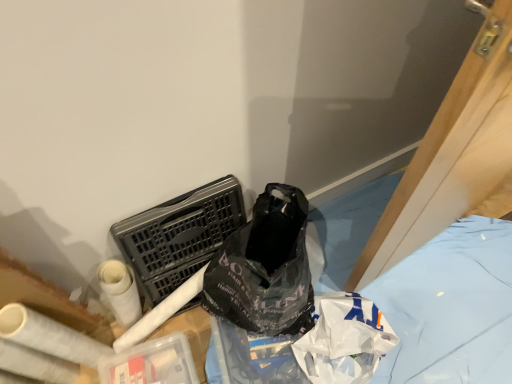
Question: Is white matte toilet paper at lower left shorter than black plastic bag at lower right?

Choices:
 (A) yes
 (B) no

Answer: (B)

Question: Does white matte toilet paper at lower left have a smaller size compared to black plastic bag at lower right?

Choices:
 (A) no
 (B) yes

Answer: (B)

Question: Considering the relative positions of white matte toilet paper at lower left and black plastic bag at lower right in the image provided, is white matte toilet paper at lower left to the right of black plastic bag at lower right from the viewer's perspective?

Choices:
 (A) no
 (B) yes

Answer: (A)

Question: From the image's perspective, would you say white matte toilet paper at lower left is shown under black plastic bag at lower right?

Choices:
 (A) no
 (B) yes

Answer: (A)

Question: Is white matte toilet paper at lower left positioned before black plastic bag at lower right?

Choices:
 (A) no
 (B) yes

Answer: (B)

Question: From a real-world perspective, is white matte toilet paper at lower left on top of black plastic bag at lower right?

Choices:
 (A) no
 (B) yes

Answer: (B)

Question: Is black plastic bag at lower right not close to black plastic laundry basket at center-left?

Choices:
 (A) yes
 (B) no

Answer: (B)

Question: From a real-world perspective, is black plastic bag at lower right on top of black plastic laundry basket at center-left?

Choices:
 (A) no
 (B) yes

Answer: (A)

Question: Considering the relative positions of black plastic bag at lower right and black plastic laundry basket at center-left in the image provided, is black plastic bag at lower right to the left of black plastic laundry basket at center-left from the viewer's perspective?

Choices:
 (A) yes
 (B) no

Answer: (B)

Question: Is black plastic bag at lower right oriented towards black plastic laundry basket at center-left?

Choices:
 (A) yes
 (B) no

Answer: (B)

Question: Is black plastic bag at lower right positioned with its back to black plastic laundry basket at center-left?

Choices:
 (A) yes
 (B) no

Answer: (B)

Question: From a real-world perspective, does black plastic bag at lower right sit lower than black plastic laundry basket at center-left?

Choices:
 (A) no
 (B) yes

Answer: (B)

Question: Considering the relative sizes of black plastic laundry basket at center-left and black plastic bag at lower right in the image provided, is black plastic laundry basket at center-left smaller than black plastic bag at lower right?

Choices:
 (A) no
 (B) yes

Answer: (B)